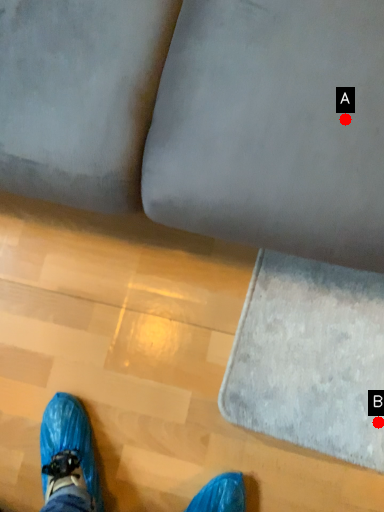
Question: Two points are circled on the image, labeled by A and B beside each circle. Which point is closer to the camera taking this photo?

Choices:
 (A) A is closer
 (B) B is closer

Answer: (A)